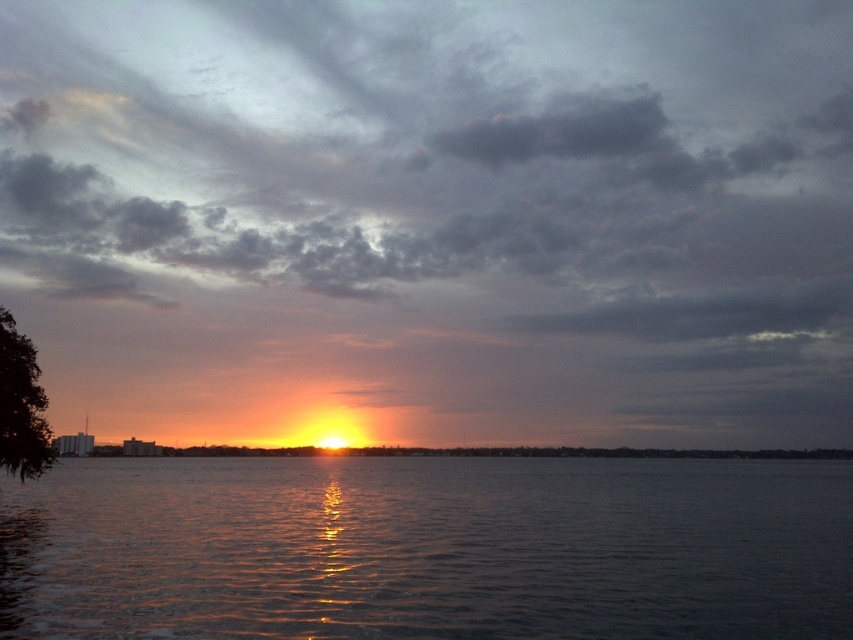
Is dark gray cloud at upper center thinner than glistening dark water at center?

No, dark gray cloud at upper center is not thinner than glistening dark water at center.

Who is shorter, dark gray cloud at upper center or glistening dark water at center?

glistening dark water at center

Is point (508, 8) behind point (689, 628)?

Yes, point (508, 8) is farther from viewer.

Identify the location of dark gray cloud at upper center. This screenshot has width=853, height=640. (432, 218).

Who is positioned more to the right, glistening dark water at center or green leafy tree at left?

From the viewer's perspective, glistening dark water at center appears more on the right side.

This screenshot has height=640, width=853. What do you see at coordinates (428, 548) in the screenshot? I see `glistening dark water at center` at bounding box center [428, 548].

Image resolution: width=853 pixels, height=640 pixels. I want to click on glistening dark water at center, so click(x=428, y=548).

Is point (155, 440) closer to camera compared to point (41, 422)?

That is False.

Can you confirm if dark gray cloud at upper center is taller than green leafy tree at left?

Yes, dark gray cloud at upper center is taller than green leafy tree at left.

Is point (268, 148) positioned after point (27, 426)?

Yes, it is behind point (27, 426).

Find the location of a particular element. dark gray cloud at upper center is located at coordinates (432, 218).